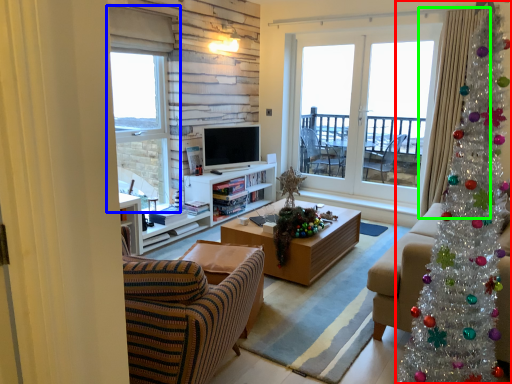
Question: Which is nearer to the christmas tree (highlighted by a red box)? window (highlighted by a blue box) or curtain (highlighted by a green box).

Choices:
 (A) window
 (B) curtain

Answer: (B)